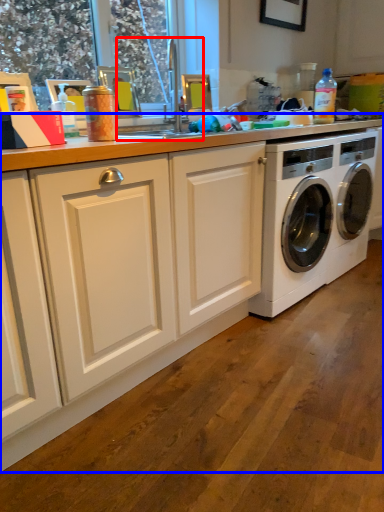
Question: Which point is closer to the camera, sink (highlighted by a red box) or countertop (highlighted by a blue box)?

Choices:
 (A) sink
 (B) countertop

Answer: (B)